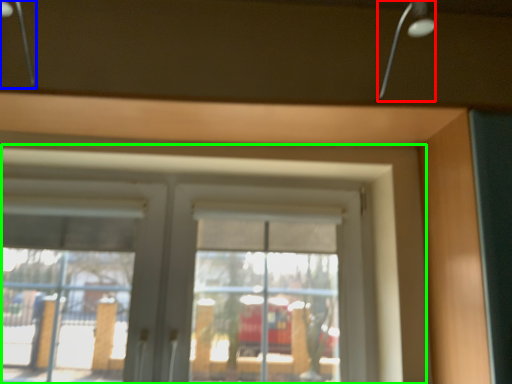
Question: Which object is positioned closest to lamp (highlighted by a red box)? Select from lamp (highlighted by a blue box) and window (highlighted by a green box).

Choices:
 (A) lamp
 (B) window

Answer: (B)